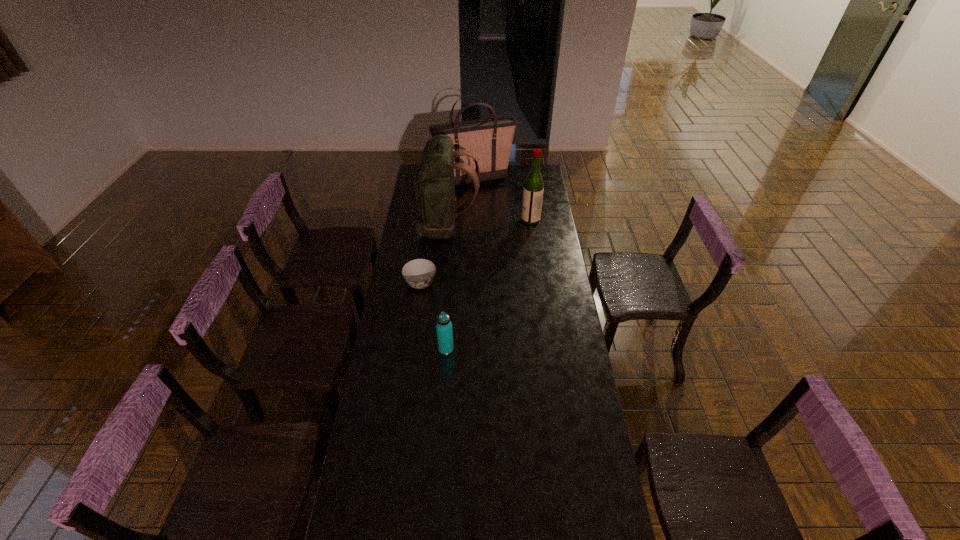
Locate an element on the screen. This screenshot has height=540, width=960. shopping bag is located at coordinates (489, 140).

Where is `backpack`? backpack is located at coordinates (434, 187).

Locate an element on the screen. This screenshot has height=540, width=960. liquor is located at coordinates point(533,189).

You are a GUI agent. You are given a task and a screenshot of the screen. Output one action in this format:
    pyautogui.click(x=<x>, y=<y>)
    Task: Click on the third shortest object
    This screenshot has width=960, height=540.
    Given the screenshot: What is the action you would take?
    pyautogui.click(x=533, y=189)

Locate an element on the screen. The height and width of the screenshot is (540, 960). the nearest object is located at coordinates (444, 331).

Find the location of a particular element. This screenshot has width=960, height=540. water bottle is located at coordinates (444, 331).

Find the location of `the shortest object`. the shortest object is located at coordinates (419, 273).

At what (x,y) coordinates should I click in order to perform the action: click on soup bowl. Please return your answer as a coordinate pair (x, y). This screenshot has height=540, width=960. Looking at the image, I should click on (419, 273).

At what (x,y) coordinates should I click in order to perform the action: click on free location located 0.060m on the left of the farthest object. Please return your answer as a coordinate pair (x, y). The image size is (960, 540). Looking at the image, I should click on (424, 179).

I want to click on vacant area situated on the back of the backpack, so click(x=491, y=226).